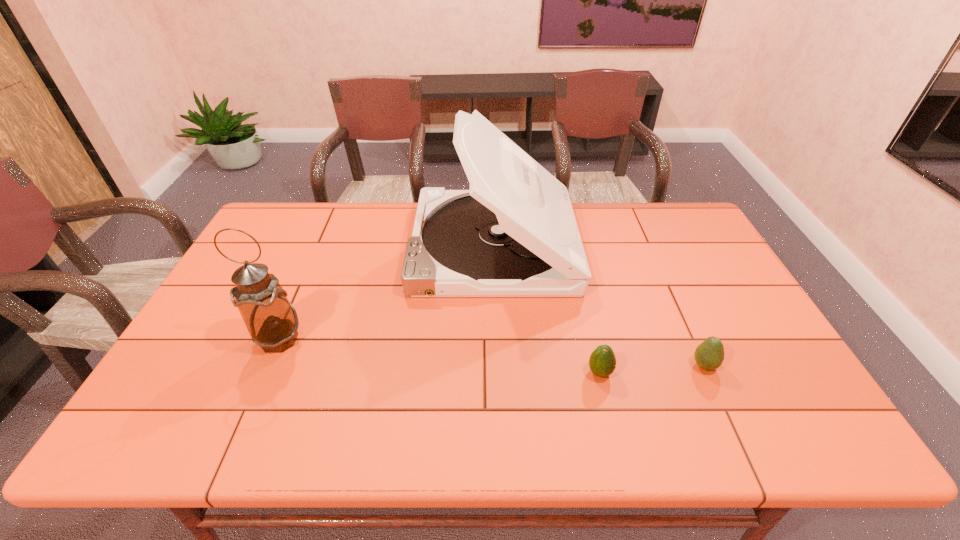
Locate an element on the screen. This screenshot has height=540, width=960. the farthest object is located at coordinates (513, 234).

Find the location of a particular element. Image resolution: width=960 pixels, height=540 pixels. the leftmost object is located at coordinates (272, 322).

This screenshot has height=540, width=960. In order to click on the right avocado in this screenshot , I will do `click(709, 355)`.

This screenshot has height=540, width=960. I want to click on the left avocado, so click(602, 361).

Locate an element on the screen. Image resolution: width=960 pixels, height=540 pixels. free spot located on the control panel of the farthest object is located at coordinates (387, 246).

I want to click on free spot located on the control panel of the farthest object, so click(350, 246).

Locate an element on the screen. vacant area situated on the control panel of the farthest object is located at coordinates (390, 246).

Where is `vacant area located on the back of the oil lamp`? The width and height of the screenshot is (960, 540). vacant area located on the back of the oil lamp is located at coordinates (303, 285).

At what (x,y) coordinates should I click in order to perform the action: click on vacant space situated on the left of the rightmost object. Please return your answer as a coordinate pair (x, y). The image size is (960, 540). Looking at the image, I should click on click(621, 366).

Identify the location of free space located 0.180m on the right of the left avocado. (687, 373).